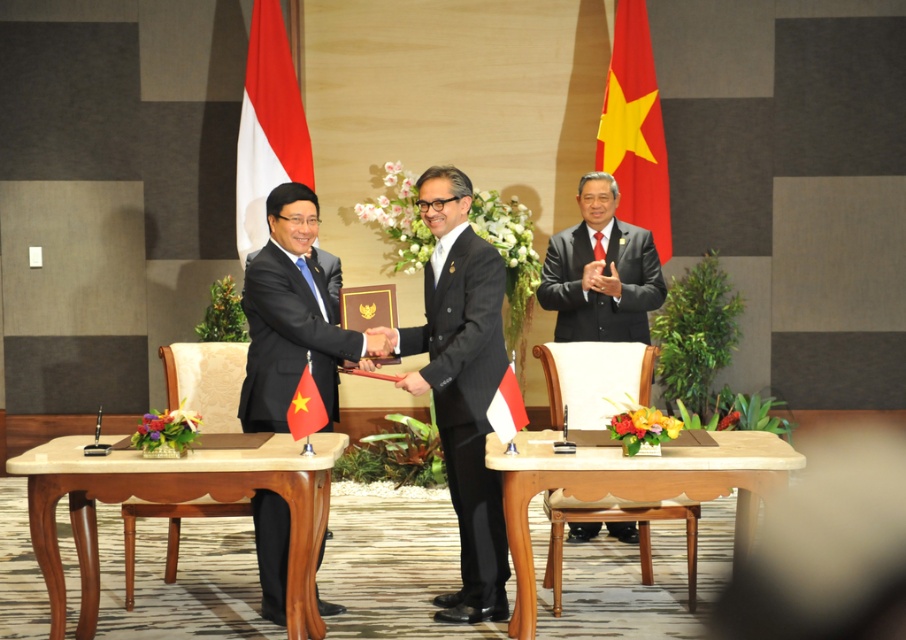
Question: Among these points, which one is farthest from the camera?

Choices:
 (A) (678, 468)
 (B) (266, 410)
 (C) (280, 118)

Answer: (C)

Question: Can you confirm if black satin suit at center is positioned to the right of white and red striped flag at center?

Choices:
 (A) no
 (B) yes

Answer: (A)

Question: Is dark gray suit at center to the left of white and red striped flag at center from the viewer's perspective?

Choices:
 (A) no
 (B) yes

Answer: (A)

Question: Which point is farther to the camera?

Choices:
 (A) click(545, 440)
 (B) click(629, 52)
 (C) click(228, 480)
 (D) click(284, 40)

Answer: (B)

Question: Does black glossy suit at center have a greater width compared to wooden table at center?

Choices:
 (A) no
 (B) yes

Answer: (A)

Question: Considering the real-world distances, which object is closest to the mahogany wood table at center?

Choices:
 (A) black satin suit at center
 (B) wooden table at center
 (C) red fabric flag at upper right
 (D) dark gray suit at center

Answer: (A)